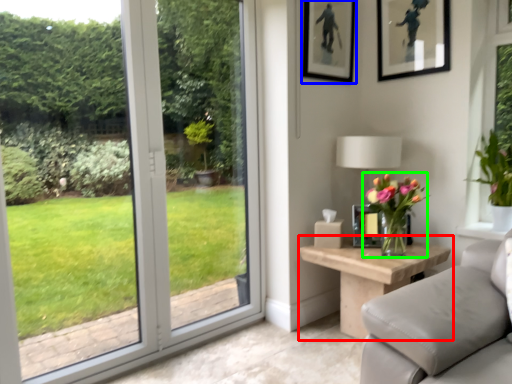
Question: Which object is the closest to the table (highlighted by a red box)? Choose among these: picture frame (highlighted by a blue box) or houseplant (highlighted by a green box).

Choices:
 (A) picture frame
 (B) houseplant

Answer: (B)